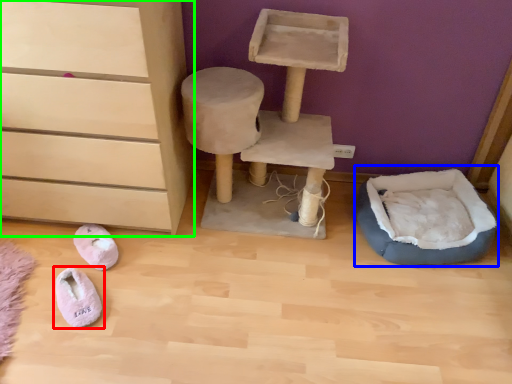
Question: Estimate the real-world distances between objects in this image. Which object is farther from footwear (highlighted by a red box), bean bag chair (highlighted by a blue box) or chest of drawers (highlighted by a green box)?

Choices:
 (A) bean bag chair
 (B) chest of drawers

Answer: (A)